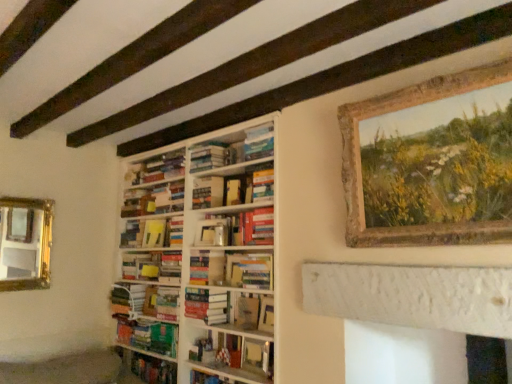
Question: Does hardcover book at center, the 3th book from the top, have a greater width compared to matte white vase at center, the 6th book in the bottom-to-top sequence?

Choices:
 (A) yes
 (B) no

Answer: (A)

Question: Is hardcover book at center, the seventh book positioned from the bottom, smaller than matte white vase at center, the 6th book in the bottom-to-top sequence?

Choices:
 (A) yes
 (B) no

Answer: (B)

Question: Is hardcover book at center, the 3th book from the top, aimed at matte white vase at center, the 4th book positioned from the top?

Choices:
 (A) no
 (B) yes

Answer: (A)

Question: Can you confirm if hardcover book at center, the 3th book from the top, is bigger than matte white vase at center, the 4th book positioned from the top?

Choices:
 (A) no
 (B) yes

Answer: (B)

Question: From the image's perspective, is hardcover book at center, the seventh book positioned from the bottom, over matte white vase at center, the 4th book positioned from the top?

Choices:
 (A) no
 (B) yes

Answer: (B)

Question: Looking at their shapes, would you say hardcover book at center, acting as the 3th paperback book starting from the bottom, is wider or thinner than white wooden bookcase at center?

Choices:
 (A) thin
 (B) wide

Answer: (A)

Question: From a real-world perspective, is hardcover book at center, acting as the 3th paperback book starting from the bottom, physically located above or below white wooden bookcase at center?

Choices:
 (A) below
 (B) above

Answer: (B)

Question: In the image, is hardcover book at center, the 4th paperback book when ordered from top to bottom, on the left side or the right side of white wooden bookcase at center?

Choices:
 (A) right
 (B) left

Answer: (A)

Question: Is hardcover book at center, acting as the 3th paperback book starting from the bottom, in front of or behind white wooden bookcase at center in the image?

Choices:
 (A) front
 (B) behind

Answer: (B)

Question: Is point (174, 175) closer or farther from the camera than point (392, 225)?

Choices:
 (A) closer
 (B) farther

Answer: (B)

Question: From their relative heights in the image, would you say hardcover books at center, which is the second book in top-to-bottom order, is taller or shorter than wooden rustic frame at upper right?

Choices:
 (A) tall
 (B) short

Answer: (B)

Question: From a real-world perspective, relative to wooden rustic frame at upper right, is hardcover books at center, which is the second book in top-to-bottom order, vertically above or below?

Choices:
 (A) above
 (B) below

Answer: (A)

Question: Considering the relative positions of hardcover books at center, the 8th book from the bottom, and wooden rustic frame at upper right in the image provided, is hardcover books at center, the 8th book from the bottom, to the left or to the right of wooden rustic frame at upper right?

Choices:
 (A) left
 (B) right

Answer: (A)

Question: Is hardcover book at center, positioned as the 2th book in bottom-to-top order, to the left or to the right of hardcover books at center, marked as the 9th book in a bottom-to-top arrangement, in the image?

Choices:
 (A) left
 (B) right

Answer: (B)

Question: From the image's perspective, is hardcover book at center, positioned as the 2th book in bottom-to-top order, located above or below hardcover books at center, marked as the 9th book in a bottom-to-top arrangement?

Choices:
 (A) above
 (B) below

Answer: (B)